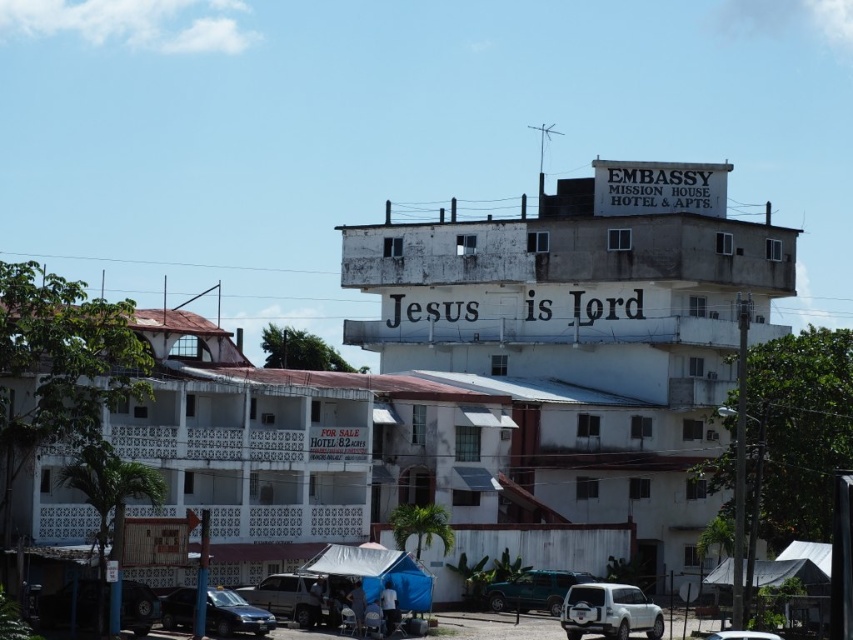
You are a delivery driver who needs to park your vehicle between two cars. The silver metallic suv at lower center and the white matte car at center are already parked. Which car should you park closer to if your vehicle is 2 meters wide?

The silver metallic suv at lower center has a lesser width compared to the white matte car at center, so you should park closer to the silver metallic suv at lower center since it is narrower and allows more space for your 2 meter wide vehicle.

You are a delivery driver who needs to park your van between the white matte suv at lower right and the teal matte car at lower center. Is there enough space for your van, which is 2 meters wide?

The white matte suv at lower right is positioned on the right side of teal matte car at lower center. Since the distance between them isn

You are a delivery person who needs to park your vehicle between the metallic silver car at lower left and the silver metallic suv at lower center. Can you fit your van, which is 2 meters wide, in the space between them?

The metallic silver car at lower left is positioned on the left side of the silver metallic suv at lower center. Since the space between them is only as wide as the distance between the two vehicles, and without specific measurements, it is uncertain if the 2 meter wide van can fit. More information about the exact width of the space is needed to determine feasibility.